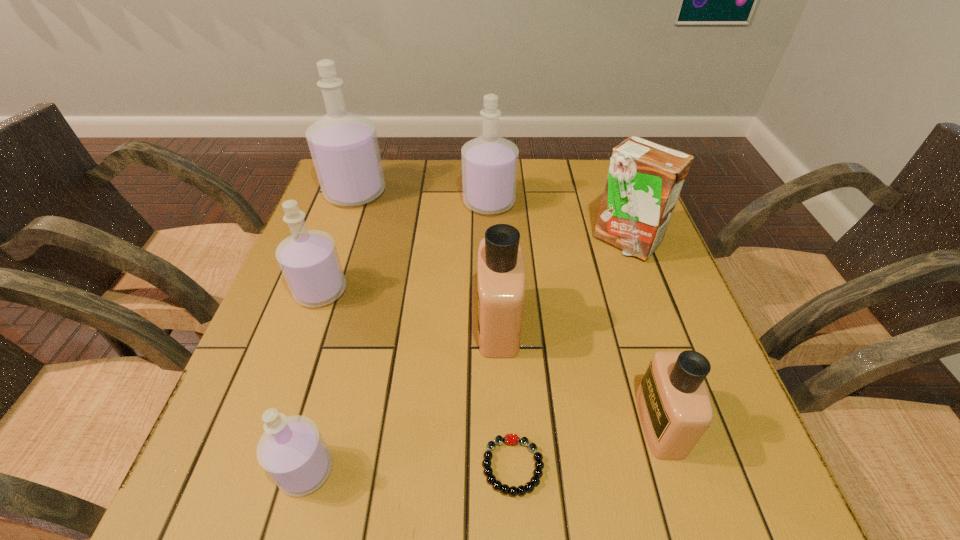
You are a GUI agent. You are given a task and a screenshot of the screen. Output one action in this format:
    pyautogui.click(x=<x>, y=<y>)
    Task: Click on the free point between the smallest purple perfume and the black bracelet
    Image resolution: width=960 pixels, height=540 pixels.
    Given the screenshot: What is the action you would take?
    pyautogui.click(x=409, y=468)

Locate an element on the screen. This screenshot has width=960, height=540. free space between the third smallest purple perfume and the nearest purple perfume is located at coordinates (397, 336).

Find the location of `vacant space in between the carton and the smaller beige perfume`. vacant space in between the carton and the smaller beige perfume is located at coordinates (642, 332).

What are the coordinates of `vacant point located between the shortest object and the farther beige perfume` in the screenshot? It's located at (506, 395).

Find the location of a particular element. This screenshot has height=540, width=960. free space between the farther beige perfume and the bracelet is located at coordinates (506, 395).

Find the location of a particular element. The height and width of the screenshot is (540, 960). object that is the fourth nearest to the shortest object is located at coordinates (309, 261).

This screenshot has height=540, width=960. In order to click on object identified as the sixth closest to the nearest purple perfume in this screenshot , I will do `click(344, 147)`.

This screenshot has height=540, width=960. In order to click on perfume identified as the closest to the smallest purple perfume in this screenshot , I will do `click(501, 282)`.

Identify which perfume is the fifth nearest to the shortest object. Please provide its 2D coordinates. Your answer should be formatted as a tuple, i.e. [(x, y)], where the tuple contains the x and y coordinates of a point satisfying the conditions above.

[(489, 163)]

Select which purple perfume is the second closest to the nearer beige perfume. Please provide its 2D coordinates. Your answer should be formatted as a tuple, i.e. [(x, y)], where the tuple contains the x and y coordinates of a point satisfying the conditions above.

[(489, 163)]